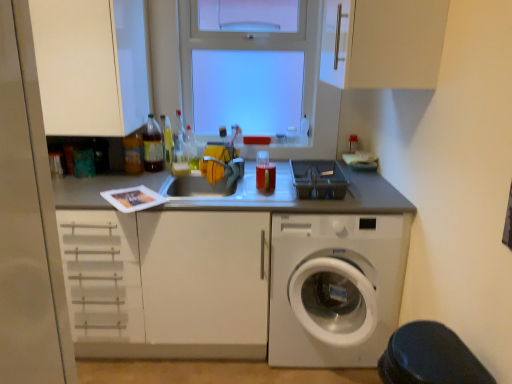
Question: In the image, is transparent glass window at upper center on the left side or the right side of white matte cabinet at upper center, which is counted as the first cabinetry, starting from the right?

Choices:
 (A) left
 (B) right

Answer: (A)

Question: From a real-world perspective, relative to white matte cabinet at upper center, which is counted as the first cabinetry, starting from the right, is transparent glass window at upper center vertically above or below?

Choices:
 (A) below
 (B) above

Answer: (A)

Question: Which object is the farthest from the transparent glass window at upper center?

Choices:
 (A) translucent plastic bottle at center, placed as the third bottle when sorted from left to right
 (B) gray plastic container at center
 (C) white matte cabinet at upper center, which appears as the 3th cabinetry when viewed from the left
 (D) translucent plastic bottle at center, which is the sixth bottle from left to right
 (E) translucent plastic bottle at upper center, positioned as the third bottle in right-to-left order

Answer: (C)

Question: Considering the real-world distances, which object is farthest from the translucent plastic bottle at center, which is the sixth bottle from left to right?

Choices:
 (A) matte white cabinet at upper left, which is the 3th cabinetry from right to left
 (B) gray plastic container at center
 (C) translucent plastic bottle at upper left, the 5th bottle in the right-to-left sequence
 (D) translucent plastic bottle at upper center, which appears as the fourth bottle when viewed from the left
 (E) black rubber step stool at lower right

Answer: (E)